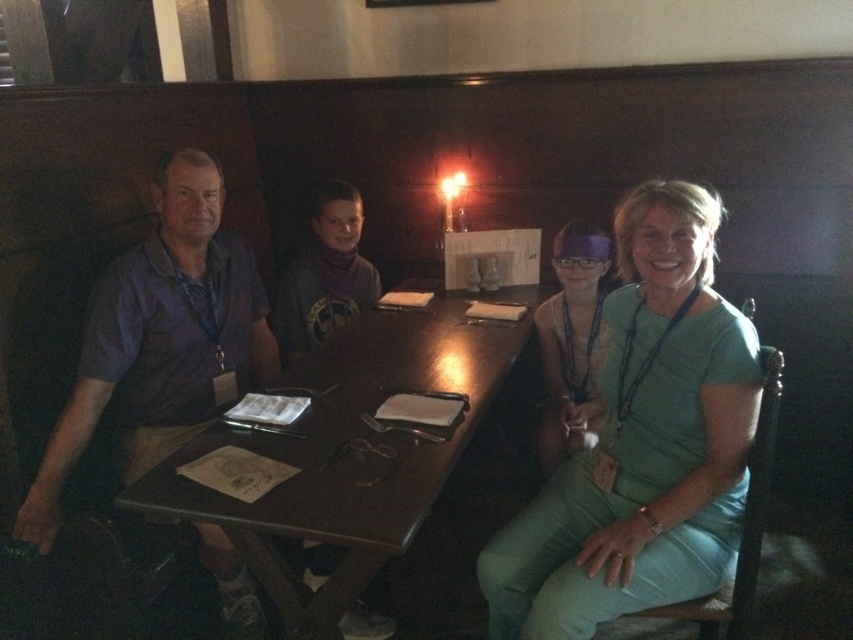
You are a photographer trying to capture a portrait of both the green cotton shirt at center and the green fabric shirt at right. Since you want to ensure both shirts are visible in the frame, which shirt should you focus on first to account for their sizes?

The green cotton shirt at center is taller than the green fabric shirt at right, so you should focus on the green cotton shirt at center first to ensure its full height is captured before adjusting the frame for the shorter green fabric shirt at right.

You are a photographer planning to take a group photo of the people at the table. Since you want to ensure that everyone is visible, you need to adjust your camera angle. Considering the sizes of the purple cotton shirt at left and matte green dress at center, which person should you focus on first to make sure their clothing is in frame?

The purple cotton shirt at left is bigger than the matte green dress at center, so you should focus on the person wearing the purple cotton shirt at left first to ensure their larger clothing is properly framed.

You are a photographer trying to capture a candid shot of the purple cotton shirt at left and the matte green dress at center without them noticing. Your camera has a lens that can focus on subjects up to 16 inches apart. Can you fit both subjects into the frame without moving the camera?

The purple cotton shirt at left and matte green dress at center are 16.23 inches apart from each other. Since the maximum distance your camera can focus on is 16 inches, which is slightly less than the actual distance between them, you cannot fit both subjects into the frame without moving the camera.